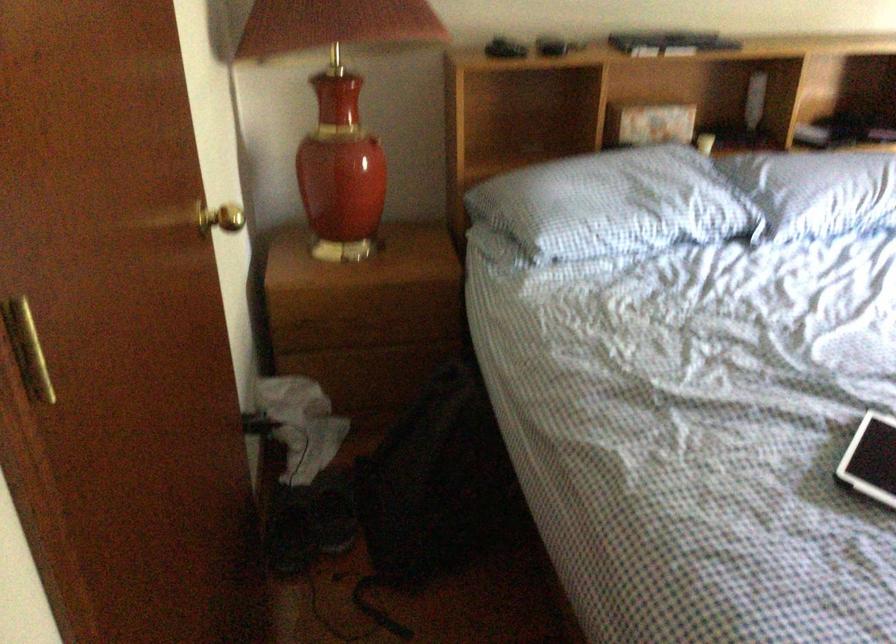
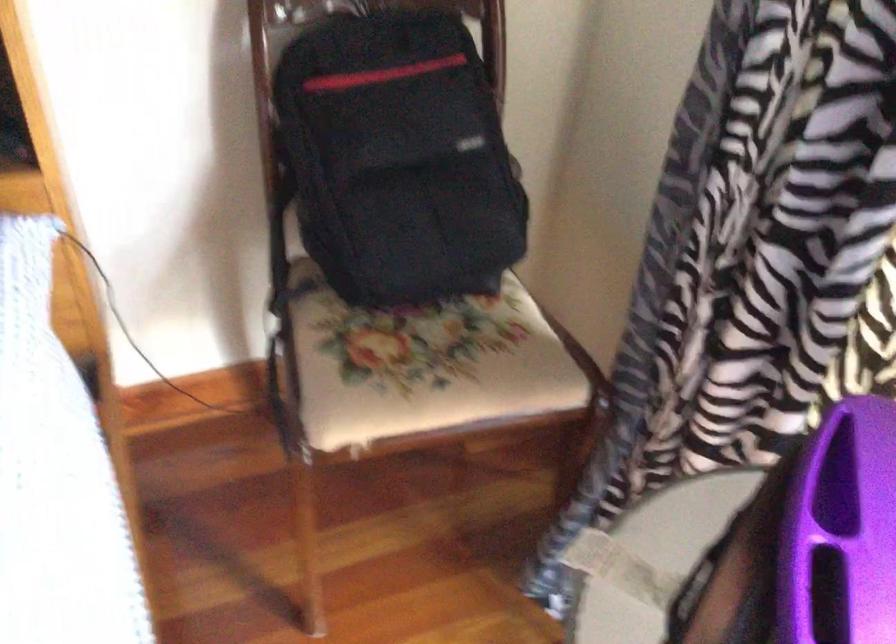
In a continuous first-person perspective shot, in which direction is the camera moving?

The movement direction of the cameraman is right, forward.